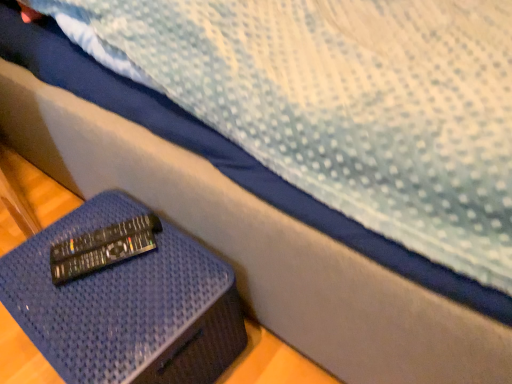
I want to click on free point to the left of black plastic remote at lower left, acting as the 1th remote starting from the back, so click(x=53, y=249).